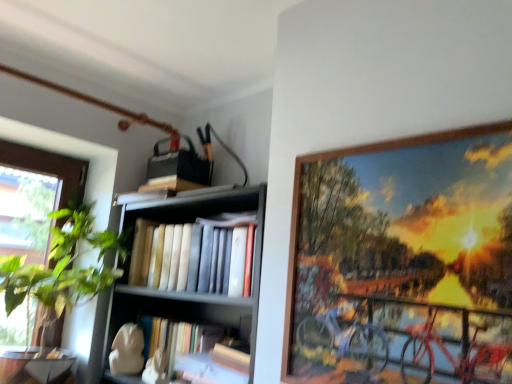
Question: From a real-world perspective, is wooden picture frame at upper right physically above wooden bookshelf at center?

Choices:
 (A) no
 (B) yes

Answer: (B)

Question: Is wooden picture frame at upper right oriented towards wooden bookshelf at center?

Choices:
 (A) yes
 (B) no

Answer: (B)

Question: Does wooden picture frame at upper right have a greater height compared to wooden bookshelf at center?

Choices:
 (A) no
 (B) yes

Answer: (A)

Question: Would you say wooden picture frame at upper right contains wooden bookshelf at center?

Choices:
 (A) no
 (B) yes

Answer: (A)

Question: Is wooden picture frame at upper right outside of wooden bookshelf at center?

Choices:
 (A) yes
 (B) no

Answer: (A)

Question: From a real-world perspective, is wooden picture frame at upper right located beneath wooden bookshelf at center?

Choices:
 (A) no
 (B) yes

Answer: (A)

Question: Does green leafy plant at left have a smaller size compared to wooden picture frame at upper right?

Choices:
 (A) yes
 (B) no

Answer: (B)

Question: From the image's perspective, does green leafy plant at left appear lower than wooden picture frame at upper right?

Choices:
 (A) no
 (B) yes

Answer: (B)

Question: From a real-world perspective, is green leafy plant at left positioned under wooden picture frame at upper right based on gravity?

Choices:
 (A) yes
 (B) no

Answer: (A)

Question: Considering the relative sizes of green leafy plant at left and wooden picture frame at upper right in the image provided, is green leafy plant at left thinner than wooden picture frame at upper right?

Choices:
 (A) no
 (B) yes

Answer: (A)

Question: From a real-world perspective, is green leafy plant at left on top of wooden picture frame at upper right?

Choices:
 (A) no
 (B) yes

Answer: (A)

Question: Can you confirm if green leafy plant at left is positioned to the left of wooden picture frame at upper right?

Choices:
 (A) yes
 (B) no

Answer: (A)

Question: From a real-world perspective, is wooden picture frame at upper right physically above hardcover books at center?

Choices:
 (A) no
 (B) yes

Answer: (A)